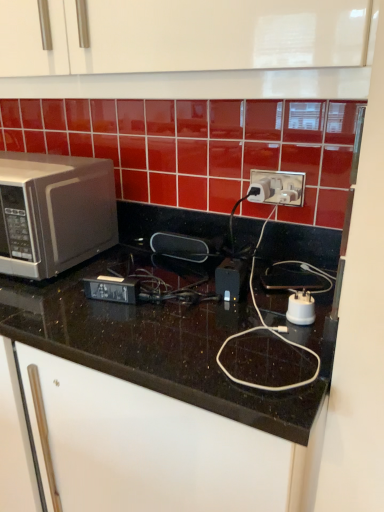
Question: Is satin silver microwave at left to the right of white plastic plug at center, arranged as the 1th appliance when viewed from the front, from the viewer's perspective?

Choices:
 (A) no
 (B) yes

Answer: (A)

Question: Does satin silver microwave at left come behind white plastic plug at center, arranged as the 1th appliance when viewed from the front?

Choices:
 (A) no
 (B) yes

Answer: (B)

Question: Is white plastic plug at center, marked as the 1th appliance in a right-to-left arrangement, surrounded by satin silver microwave at left?

Choices:
 (A) yes
 (B) no

Answer: (B)

Question: Does satin silver microwave at left appear on the left side of white plastic plug at center, marked as the 1th appliance in a right-to-left arrangement?

Choices:
 (A) no
 (B) yes

Answer: (B)

Question: Could you tell me if satin silver microwave at left is turned towards white plastic plug at center, arranged as the 1th appliance when viewed from the front?

Choices:
 (A) yes
 (B) no

Answer: (B)

Question: Is white plastic plug at center, acting as the 2th appliance starting from the back, inside the boundaries of satin silver microwave at left, or outside?

Choices:
 (A) outside
 (B) inside

Answer: (A)

Question: In terms of size, does white plastic plug at center, arranged as the 1th appliance when viewed from the front, appear bigger or smaller than satin silver microwave at left?

Choices:
 (A) small
 (B) big

Answer: (A)

Question: In terms of height, does white plastic plug at center, marked as the 1th appliance in a right-to-left arrangement, look taller or shorter compared to satin silver microwave at left?

Choices:
 (A) short
 (B) tall

Answer: (A)

Question: Would you say white plastic plug at center, which appears as the first appliance when ordered from the bottom, is to the left or to the right of satin silver microwave at left in the picture?

Choices:
 (A) right
 (B) left

Answer: (A)

Question: From a real-world perspective, relative to white plastic power plugs and sockets at center, is black granite countertop at center vertically above or below?

Choices:
 (A) below
 (B) above

Answer: (A)

Question: Is black granite countertop at center to the left or to the right of white plastic power plugs and sockets at center in the image?

Choices:
 (A) left
 (B) right

Answer: (A)

Question: In terms of width, does black granite countertop at center look wider or thinner when compared to white plastic power plugs and sockets at center?

Choices:
 (A) thin
 (B) wide

Answer: (B)

Question: Which is correct: black granite countertop at center is inside white plastic power plugs and sockets at center, or outside of it?

Choices:
 (A) inside
 (B) outside

Answer: (B)

Question: Is white plastic power plugs and sockets at center wider or thinner than black rubberized speaker at center, which appears as the 2th appliance when viewed from the front?

Choices:
 (A) thin
 (B) wide

Answer: (A)

Question: Is point (251, 169) positioned closer to the camera than point (185, 239)?

Choices:
 (A) farther
 (B) closer

Answer: (B)